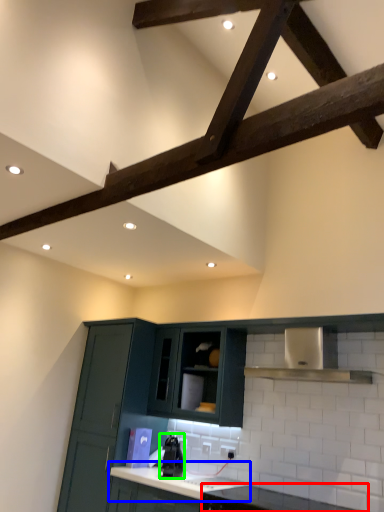
Question: Which is nearer to the countertop (highlighted by a red box)? countertop (highlighted by a blue box) or appliance (highlighted by a green box).

Choices:
 (A) countertop
 (B) appliance

Answer: (A)